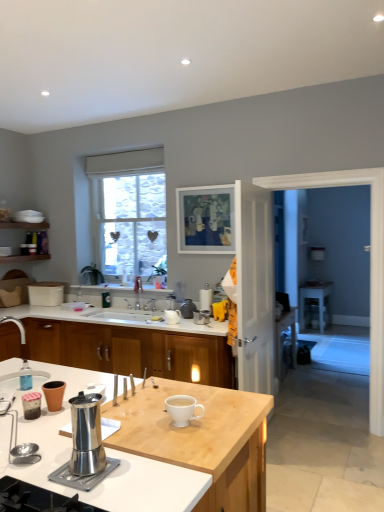
Question: From the image's perspective, would you say white ceramic sink at center is shown under white glossy door at center, positioned as the first screen door in left-to-right order?

Choices:
 (A) no
 (B) yes

Answer: (B)

Question: Does white ceramic sink at center have a lesser width compared to white glossy door at center, which is counted as the second screen door, starting from the right?

Choices:
 (A) yes
 (B) no

Answer: (B)

Question: Is white ceramic sink at center completely or partially outside of white glossy door at center, positioned as the first screen door in left-to-right order?

Choices:
 (A) no
 (B) yes

Answer: (B)

Question: Does white ceramic sink at center have a greater height compared to white glossy door at center, positioned as the first screen door in left-to-right order?

Choices:
 (A) no
 (B) yes

Answer: (A)

Question: From a real-world perspective, is white ceramic sink at center on white glossy door at center, positioned as the first screen door in left-to-right order?

Choices:
 (A) no
 (B) yes

Answer: (A)

Question: Is white glossy door at center, which is counted as the second screen door, starting from the right, completely or partially inside white ceramic sink at center?

Choices:
 (A) yes
 (B) no

Answer: (B)

Question: Is wooden cabinet at center aimed at matte white desk at right?

Choices:
 (A) no
 (B) yes

Answer: (A)

Question: Does wooden cabinet at center have a greater width compared to matte white desk at right?

Choices:
 (A) no
 (B) yes

Answer: (B)

Question: Would you say wooden cabinet at center is outside matte white desk at right?

Choices:
 (A) yes
 (B) no

Answer: (A)

Question: Is the depth of wooden cabinet at center less than that of matte white desk at right?

Choices:
 (A) no
 (B) yes

Answer: (B)

Question: Considering the relative sizes of wooden cabinet at center and matte white desk at right in the image provided, is wooden cabinet at center thinner than matte white desk at right?

Choices:
 (A) no
 (B) yes

Answer: (A)

Question: Is wooden cabinet at center at the left side of matte white desk at right?

Choices:
 (A) no
 (B) yes

Answer: (B)

Question: Can you confirm if white ceramic sink at center is smaller than white paper towel holder at center, which ranks as the second appliance in front-to-back order?

Choices:
 (A) no
 (B) yes

Answer: (A)